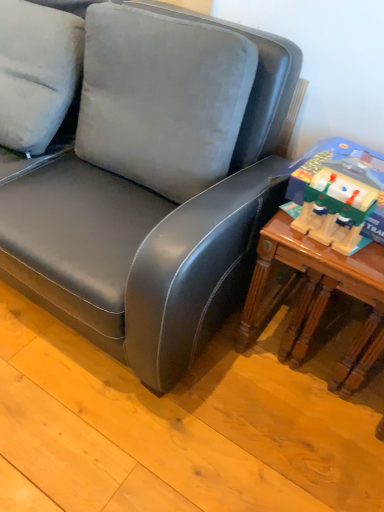
Locate an element on the screen. vacant area that is in front of wooden table at right is located at coordinates (283, 450).